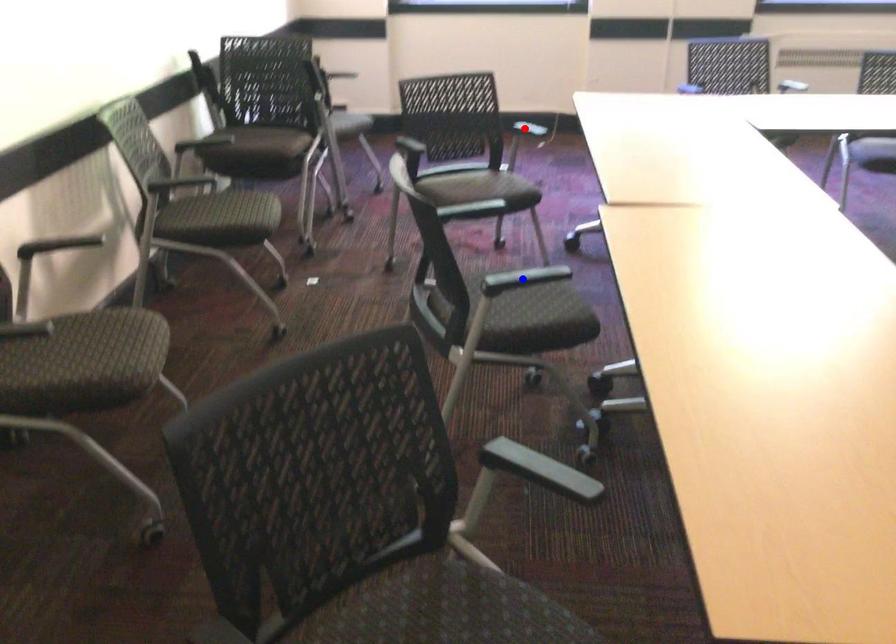
Question: Which of the two points in the image is closer to the camera?

Choices:
 (A) Blue point is closer.
 (B) Red point is closer.

Answer: (A)